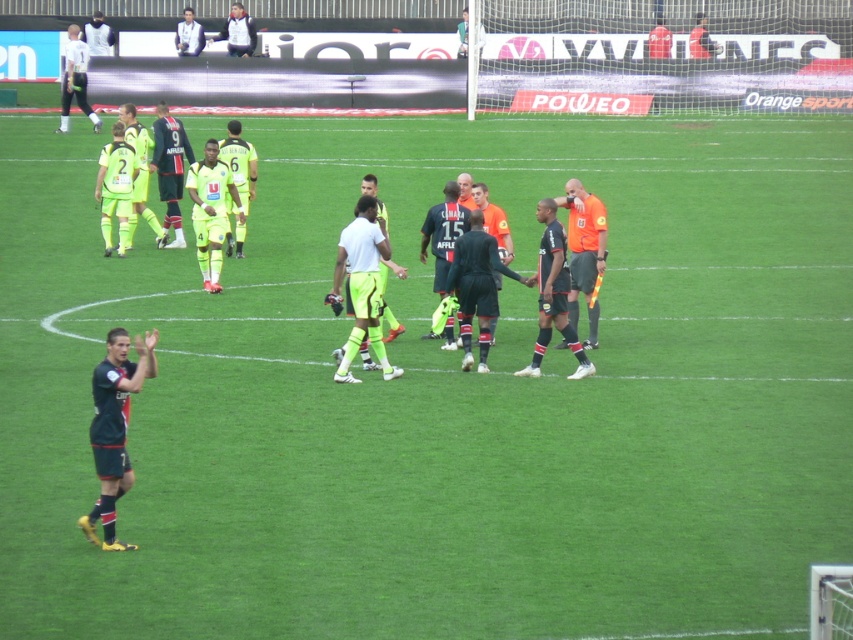
Is orange matte referee at center closer to camera compared to black matte suit at center?

No, orange matte referee at center is behind black matte suit at center.

Is orange matte referee at center to the left of black matte suit at center from the viewer's perspective?

No, orange matte referee at center is not to the left of black matte suit at center.

At what (x,y) coordinates should I click in order to perform the action: click on orange matte referee at center. Please return your answer as a coordinate pair (x, y). The width and height of the screenshot is (853, 640). Looking at the image, I should click on (583, 241).

Is the position of yellow-green jersey at center less distant than that of white matte shirt at center?

No.

Between yellow-green jersey at center and white matte shirt at center, which one is positioned higher?

yellow-green jersey at center is above.

Measure the distance between yellow-green jersey at center and camera.

They are 19.86 meters apart.

At what (x,y) coordinates should I click in order to perform the action: click on yellow-green jersey at center. Please return your answer as a coordinate pair (x, y). This screenshot has width=853, height=640. Looking at the image, I should click on (238, 182).

Between point (445, 330) and point (135, 150), which one is positioned in front?

Point (445, 330) is more forward.

Does black matte jersey at center have a larger size compared to neon yellow jersey at center?

Yes, black matte jersey at center is bigger than neon yellow jersey at center.

Between point (450, 205) and point (119, 116), which one is positioned behind?

Point (119, 116)

Image resolution: width=853 pixels, height=640 pixels. In order to click on black matte jersey at center in this screenshot , I will do click(444, 232).